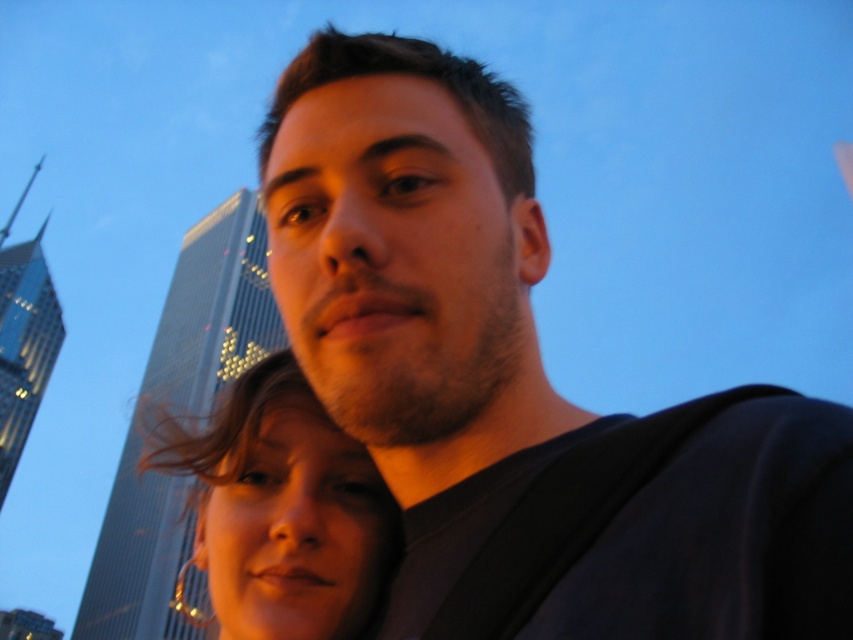
From the picture: Who is shorter, matte black shirt at center or matte gold hoop earrings at lower left?

matte gold hoop earrings at lower left

Describe the element at coordinates (416, 285) in the screenshot. I see `matte black shirt at center` at that location.

Where is `matte black shirt at center`? This screenshot has height=640, width=853. matte black shirt at center is located at coordinates (416, 285).